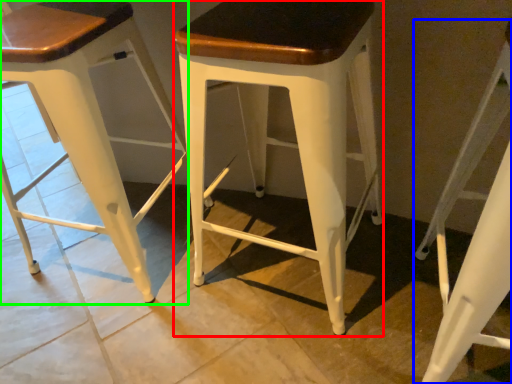
Question: Estimate the real-world distances between objects in this image. Which object is closer to stool (highlighted by a red box), stool (highlighted by a blue box) or stool (highlighted by a green box)?

Choices:
 (A) stool
 (B) stool

Answer: (A)